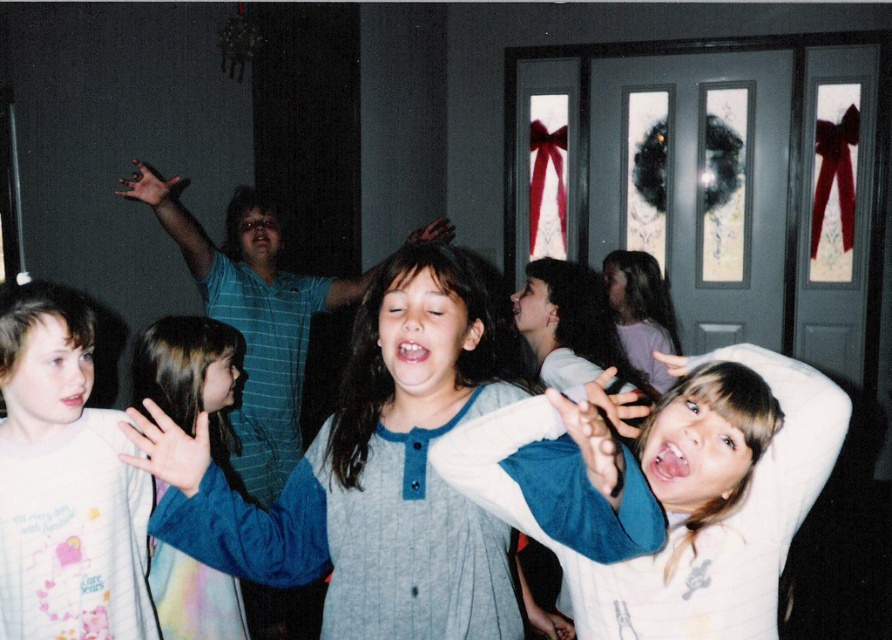
Which is more to the right, blue striped pajamas at center or blue fabric shirt at center?

blue striped pajamas at center

Which is below, blue striped pajamas at center or blue fabric shirt at center?

blue fabric shirt at center is below.

Between point (296, 541) and point (203, 388), which one is positioned in front?

Positioned in front is point (296, 541).

Find the location of a particular element. This screenshot has width=892, height=640. blue striped pajamas at center is located at coordinates (370, 470).